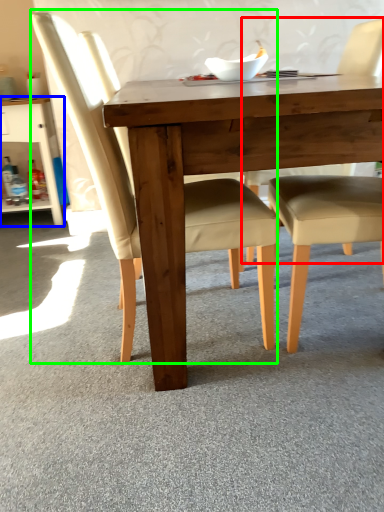
Question: Considering the real-world distances, which object is farthest from chair (highlighted by a red box)? dresser (highlighted by a blue box) or chair (highlighted by a green box)?

Choices:
 (A) dresser
 (B) chair

Answer: (A)